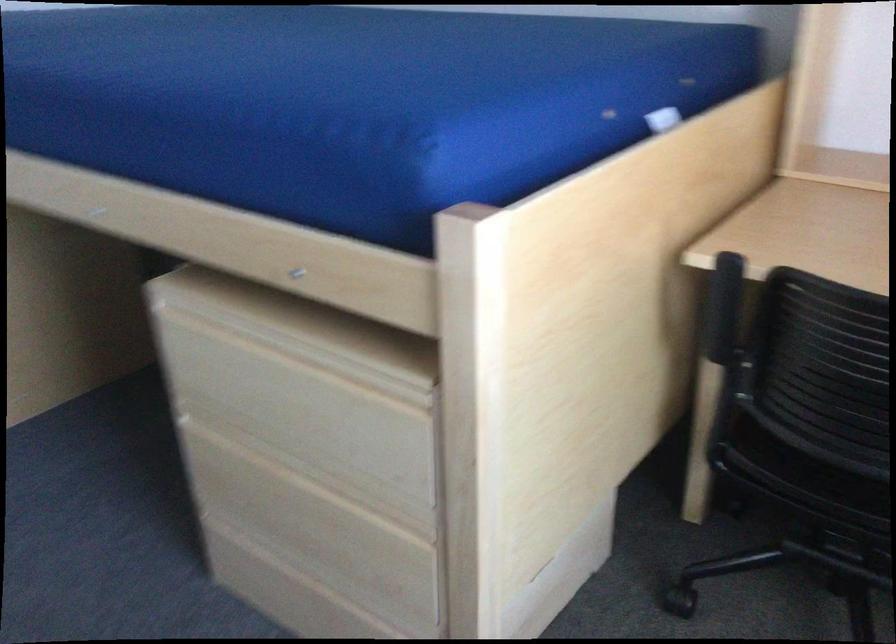
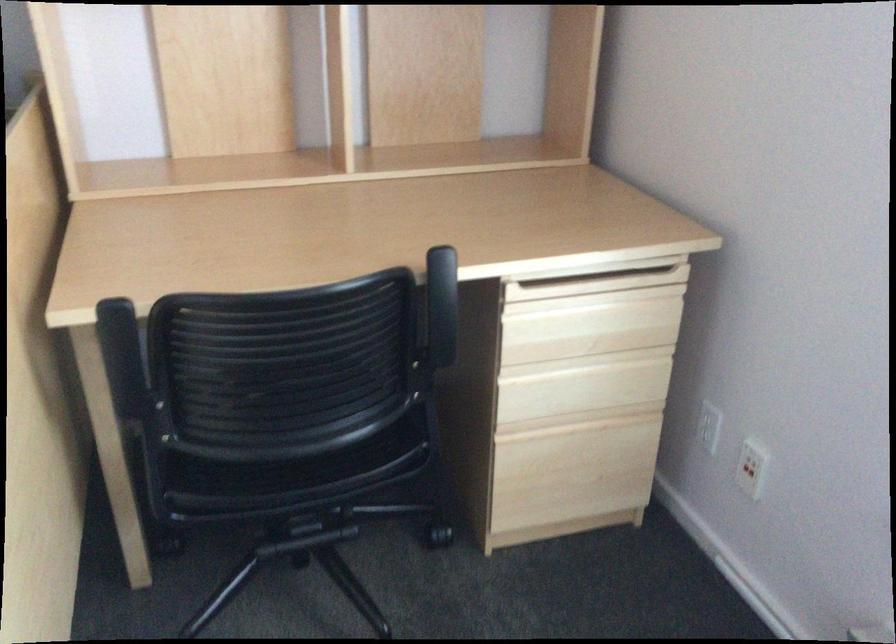
Find the pixel in the second image that matches the point at 716,310 in the first image.

(123, 360)